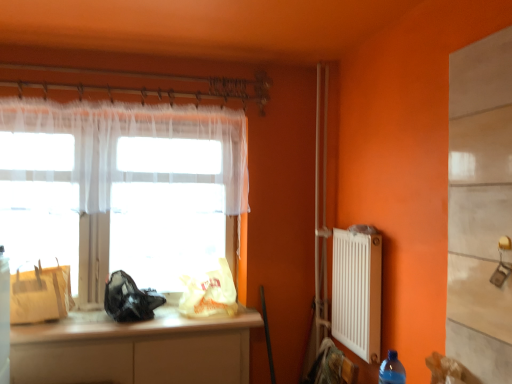
Question: From the image's perspective, is matte yellow paper bag at left, which appears as the 3th bag when viewed from the right, located beneath translucent fabric at left?

Choices:
 (A) no
 (B) yes

Answer: (B)

Question: Is matte yellow paper bag at left, arranged as the first bag when viewed from the left, facing away from translucent fabric at left?

Choices:
 (A) yes
 (B) no

Answer: (A)

Question: Is matte yellow paper bag at left, which appears as the 3th bag when viewed from the right, not within translucent fabric at left?

Choices:
 (A) yes
 (B) no

Answer: (A)

Question: Are matte yellow paper bag at left, which appears as the 3th bag when viewed from the right, and translucent fabric at left located far from each other?

Choices:
 (A) no
 (B) yes

Answer: (A)

Question: Considering the relative positions of matte yellow paper bag at left, arranged as the first bag when viewed from the left, and translucent fabric at left in the image provided, is matte yellow paper bag at left, arranged as the first bag when viewed from the left, in front of translucent fabric at left?

Choices:
 (A) no
 (B) yes

Answer: (B)

Question: Considering the positions of translucent fabric at left and black matte bag at window, acting as the second bag starting from the right, in the image, is translucent fabric at left taller or shorter than black matte bag at window, acting as the second bag starting from the right,?

Choices:
 (A) short
 (B) tall

Answer: (B)

Question: Considering their positions, is translucent fabric at left located in front of or behind black matte bag at window, acting as the second bag starting from the right?

Choices:
 (A) front
 (B) behind

Answer: (B)

Question: Is translucent fabric at left inside or outside of black matte bag at window, acting as the second bag starting from the right?

Choices:
 (A) inside
 (B) outside

Answer: (B)

Question: Visually, is translucent fabric at left positioned to the left or to the right of black matte bag at window, arranged as the 2th bag when viewed from the left?

Choices:
 (A) left
 (B) right

Answer: (A)

Question: Is point (137, 109) positioned closer to the camera than point (199, 311)?

Choices:
 (A) closer
 (B) farther

Answer: (A)

Question: Which is correct: white sheer curtain at upper left is inside translucent plastic bag at window, the 3th bag from the left, or outside of it?

Choices:
 (A) outside
 (B) inside

Answer: (A)

Question: From the image's perspective, is white sheer curtain at upper left above or below translucent plastic bag at window, the 3th bag from the left?

Choices:
 (A) below
 (B) above

Answer: (B)

Question: Considering the relative positions of white sheer curtain at upper left and translucent plastic bag at window, the 3th bag from the left, in the image provided, is white sheer curtain at upper left to the left or to the right of translucent plastic bag at window, the 3th bag from the left,?

Choices:
 (A) right
 (B) left

Answer: (B)

Question: From a real-world perspective, is blue plastic bottle at lower right physically located above or below matte yellow paper bag at left, arranged as the first bag when viewed from the left?

Choices:
 (A) below
 (B) above

Answer: (A)

Question: In the image, is blue plastic bottle at lower right positioned in front of or behind matte yellow paper bag at left, which appears as the 3th bag when viewed from the right?

Choices:
 (A) behind
 (B) front

Answer: (B)